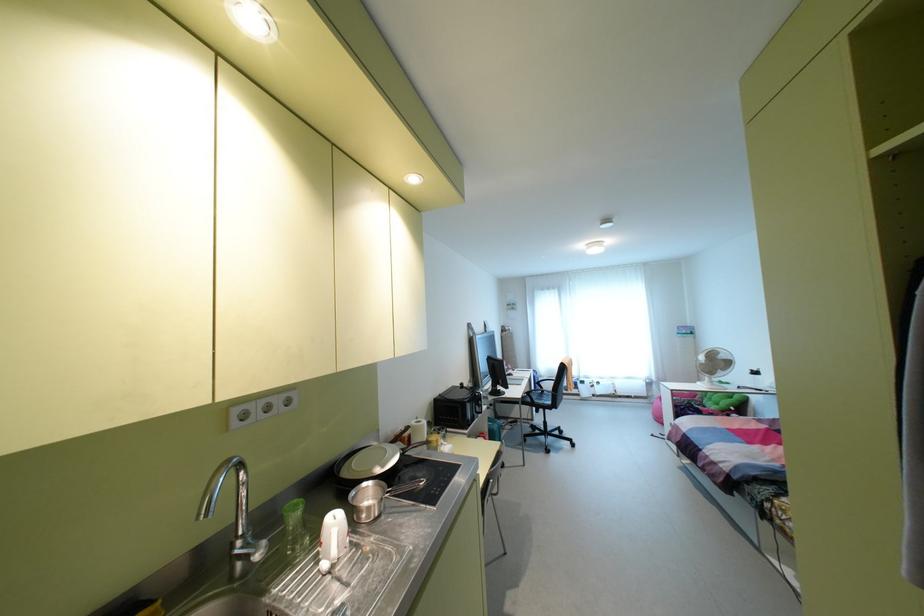
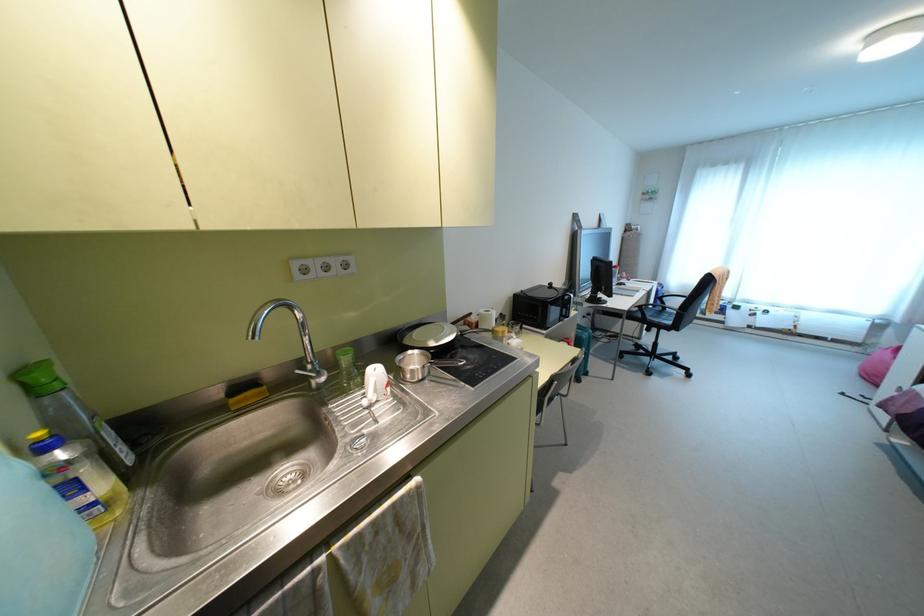
Locate, in the second image, the point that corresponds to pixel 382 466 in the first image.

(435, 341)